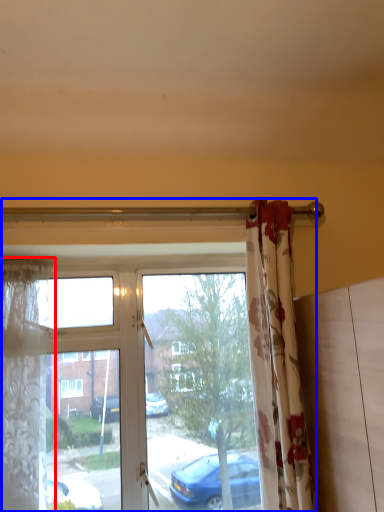
Question: Among these objects, which one is nearest to the camera, curtain (highlighted by a red box) or window (highlighted by a blue box)?

Choices:
 (A) curtain
 (B) window

Answer: (A)